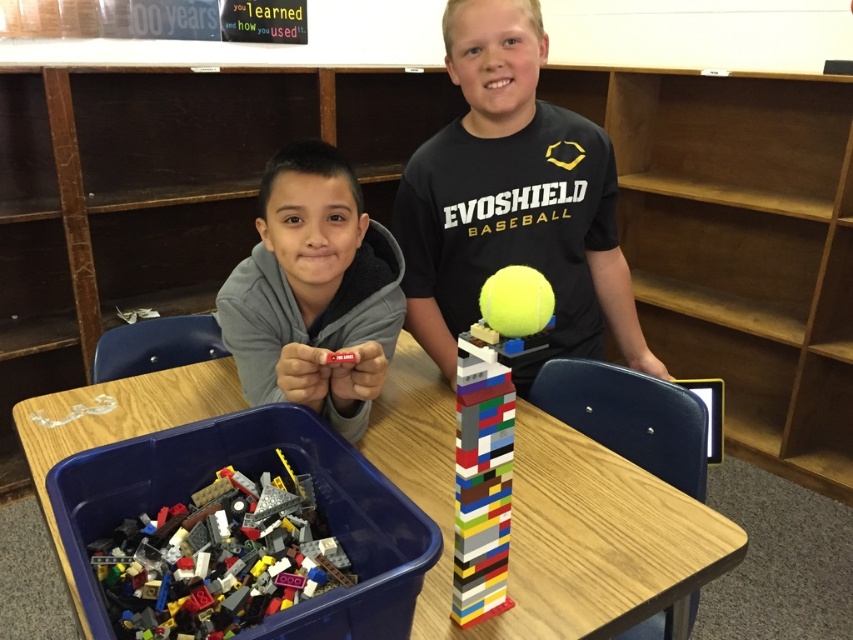
You are a photographer standing in front of the table. You want to capture a photo of the matte black shirt at center without the multicolored plastic lego pieces at lower left appearing in the background. Can you achieve this by moving closer to the shirt?

The multicolored plastic lego pieces at lower left are behind the matte black shirt at center, so moving closer to the shirt would reduce the background area, potentially hiding the lego pieces. Yes, moving closer should help achieve the desired result.

You are a photographer standing in front of the table. You want to take a photo of the LEGO structure. Which of the two points, point (453, 419) or point (149, 541), is closer to the camera?

Point (453, 419) is closer to the camera than point (149, 541).

You are a teacher in the classroom. You need to place a 30 inch long ruler between the matte black shirt at center and the multicolored plastic lego pieces at lower left. Will the ruler fit between them?

The distance between the matte black shirt at center and the multicolored plastic lego pieces at lower left is 29.15 inches. Since the ruler is 30 inches long, it will not fit between them as the space is slightly shorter than the ruler.